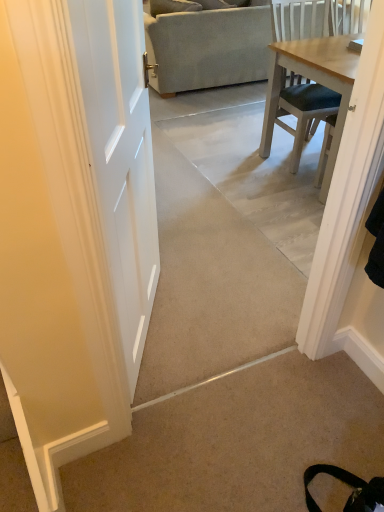
Question: Would you say light gray fabric couch at upper center is inside or outside beige carpet at lower right?

Choices:
 (A) outside
 (B) inside

Answer: (A)

Question: Based on their sizes in the image, would you say light gray fabric couch at upper center is bigger or smaller than beige carpet at lower right?

Choices:
 (A) big
 (B) small

Answer: (A)

Question: From a real-world perspective, is light gray fabric couch at upper center physically located above or below beige carpet at lower right?

Choices:
 (A) above
 (B) below

Answer: (A)

Question: Is beige carpet at lower right in front of or behind light gray fabric couch at upper center in the image?

Choices:
 (A) front
 (B) behind

Answer: (A)

Question: Would you say beige carpet at lower right is inside or outside light gray fabric couch at upper center?

Choices:
 (A) outside
 (B) inside

Answer: (A)

Question: Is point (289, 373) positioned closer to the camera than point (152, 9)?

Choices:
 (A) closer
 (B) farther

Answer: (A)

Question: In terms of size, does beige carpet at lower right appear bigger or smaller than light gray fabric couch at upper center?

Choices:
 (A) small
 (B) big

Answer: (A)